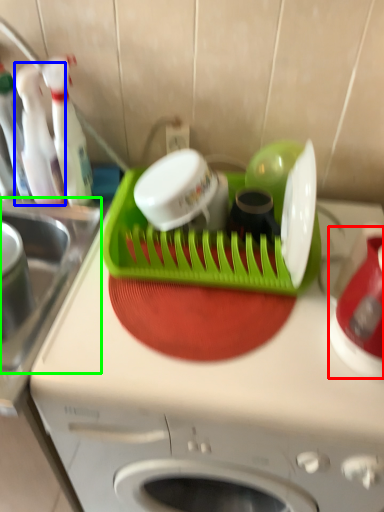
Question: Which object is positioned closest to appliance (highlighted by a red box)? Select from bottle (highlighted by a blue box) and sink (highlighted by a green box).

Choices:
 (A) bottle
 (B) sink

Answer: (B)